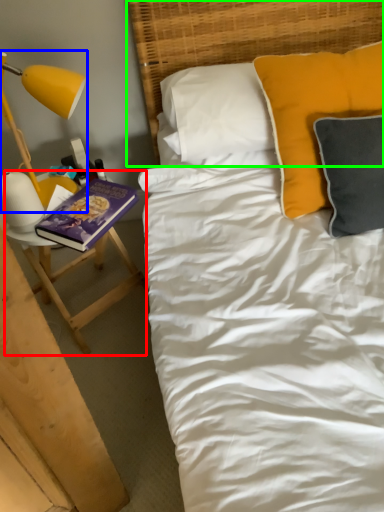
Question: Which object is positioned farthest from table (highlighted by a red box)? Select from lamp (highlighted by a blue box) and headboard (highlighted by a green box).

Choices:
 (A) lamp
 (B) headboard

Answer: (B)